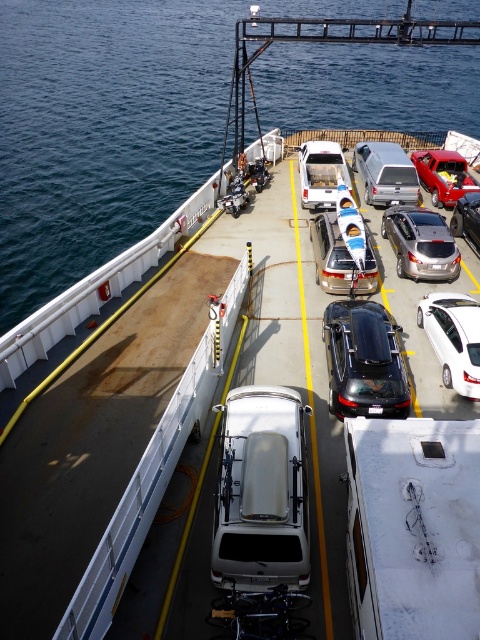
You are a ferry attendant and need to load a new vehicle onto the deck. The new vehicle is taller than the white glossy sedan at center but shorter than the satin silver suv at center. Where should you place it to ensure it fits within the height restrictions?

You should place the new vehicle between the white glossy sedan at center and the satin silver suv at center, as its height is between the two, ensuring it fits within the allowed space.

You are a ferry attendant and need to park a new vehicle on the deck. The deck has limited space between the white glossy sedan at center and the matte black car at center. Which vehicle should you move to accommodate a larger truck?

The white glossy sedan at center is larger than the matte black car at center, so moving the smaller matte black car at center would allow more space for the larger truck.

You are a passenger on the ferry and want to take a photo of both the white glossy sedan at center and the matte black car at center from the passenger area. Which car should you stand closer to the white railing on the left to capture in your photo?

You should stand closer to the white railing on the left to capture the matte black car at center because the white glossy sedan at center is to the right of the matte black car at center, so the matte black car at center is closer to the left side of the deck.